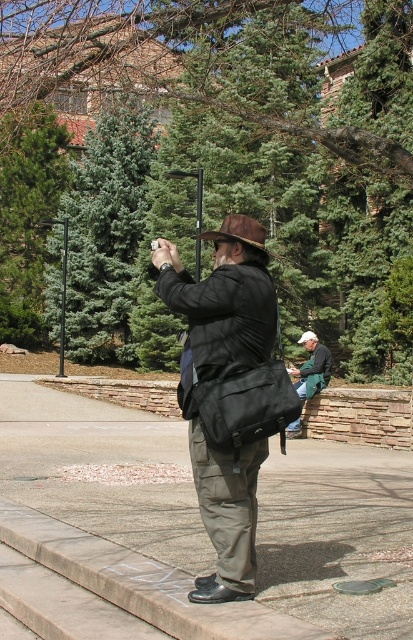
You are a photographer carrying a matte black bag at center and wearing a green fabric jacket at center. You need to pass through a narrow doorway that is 60 cm wide. Can you fit through while carrying the bag?

The matte black bag at center might be wider than the green fabric jacket at center, so there is a possibility that the bag could be wider than 60 cm. If the bag is wider than 60 cm, you might not fit through the doorway while carrying it.